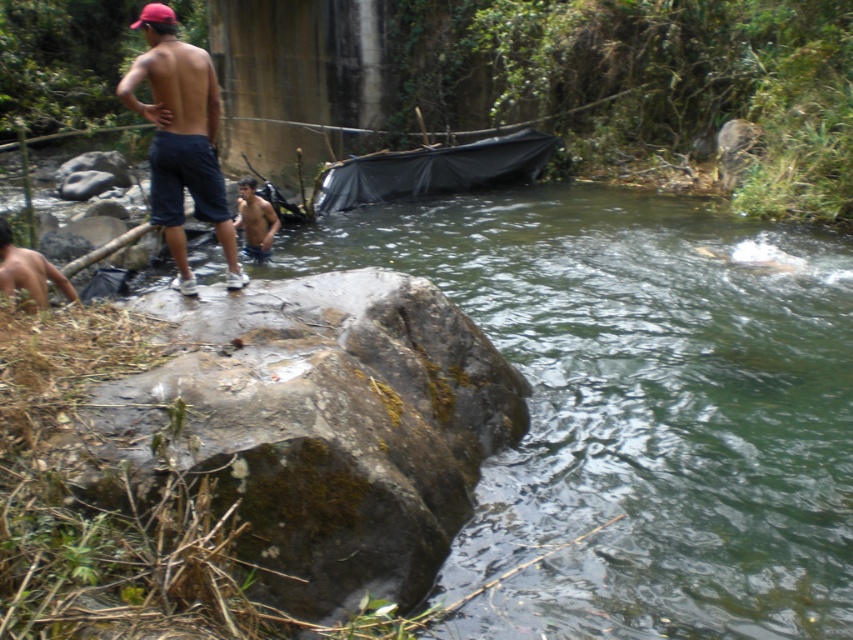
Consider the image. You are a photographer standing at the riverbank. You want to take a photo that includes both the brown skin boy at lower left and the brown skin man at center. Which of them should you focus on first to ensure both are in sharp focus?

You should focus on the brown skin man at center first because the brown skin boy at lower left is closer to the viewer, so adjusting focus starting from the closer subject will help ensure both are in focus.

You are a photographer trying to capture a candid shot of the brown skin man at center without him noticing. You are currently standing near the dark blue denim shorts at upper left. Considering the distance between them, can you use a standard zoom lens with a maximum range of 100mm to take a clear photo?

The dark blue denim shorts at upper left and brown skin man at center are 3.87 meters apart. A standard zoom lens with a maximum of 100mm can effectively capture a clear image from this distance, so yes, you can take the photo without the subject noticing.

Based on the photo, you are a photographer taking a picture of the two points in the scene. Which point, point (193, 182) or point (247, 244), will appear larger in your photo?

Point (193, 182) will appear larger in the photo because it is closer to the camera than point (247, 244).